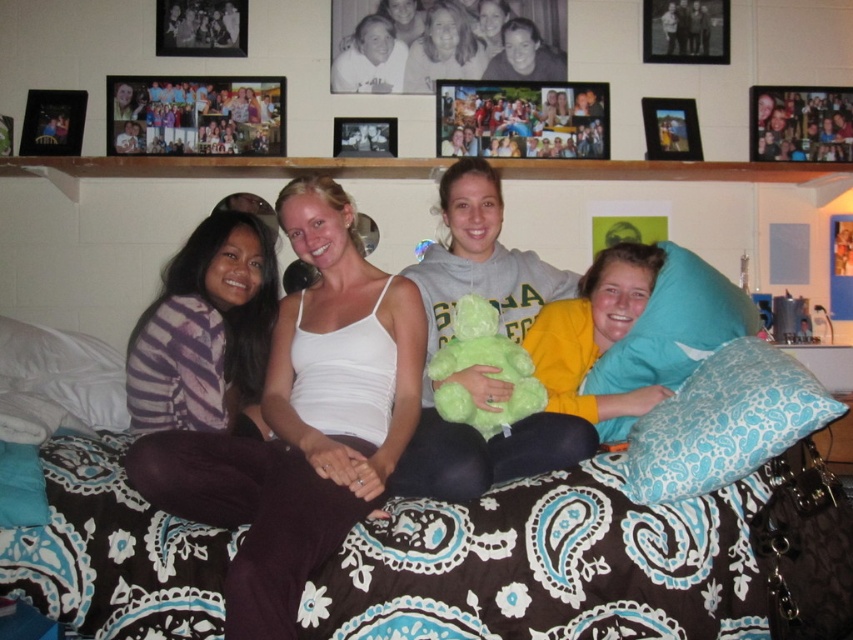
Question: Which is nearer to the brown paisley fabric bed at center?

Choices:
 (A) matte plastic photo collage at upper center
 (B) green plush bear at center

Answer: (B)

Question: Is the position of white glossy photo frame at upper center more distant than that of green plush at center?

Choices:
 (A) no
 (B) yes

Answer: (B)

Question: Does purple striped shirt at left appear on the right side of metallic photo frame at upper left?

Choices:
 (A) no
 (B) yes

Answer: (B)

Question: Which is nearer to the teal fabric pillow at right?

Choices:
 (A) blue paisley pillow at right
 (B) green plush at center

Answer: (A)

Question: Does blue paisley pillow at right appear over wooden photo frame at upper right?

Choices:
 (A) yes
 (B) no

Answer: (B)

Question: Which is nearer to the green plush at center?

Choices:
 (A) yellow fleece sweater at right
 (B) green plush bear at center

Answer: (B)